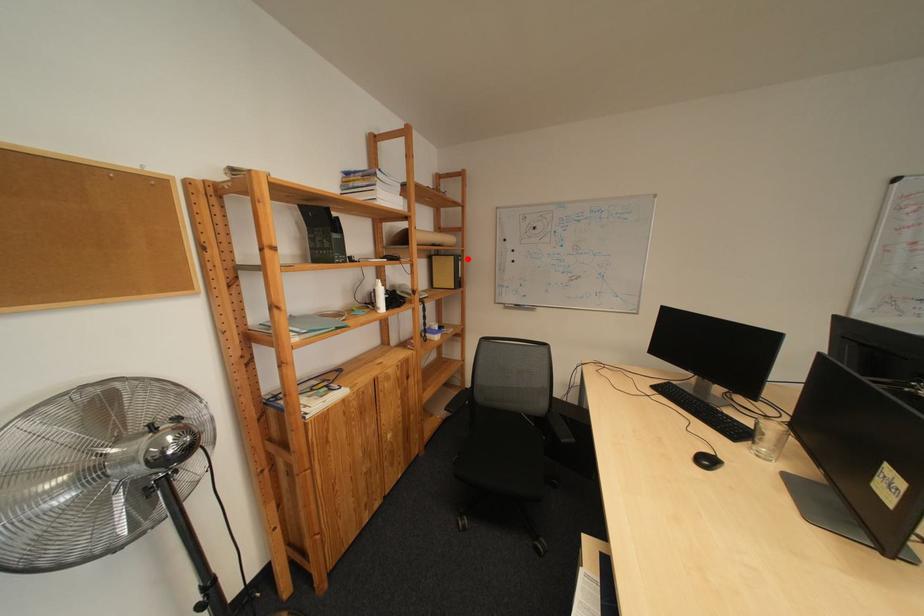
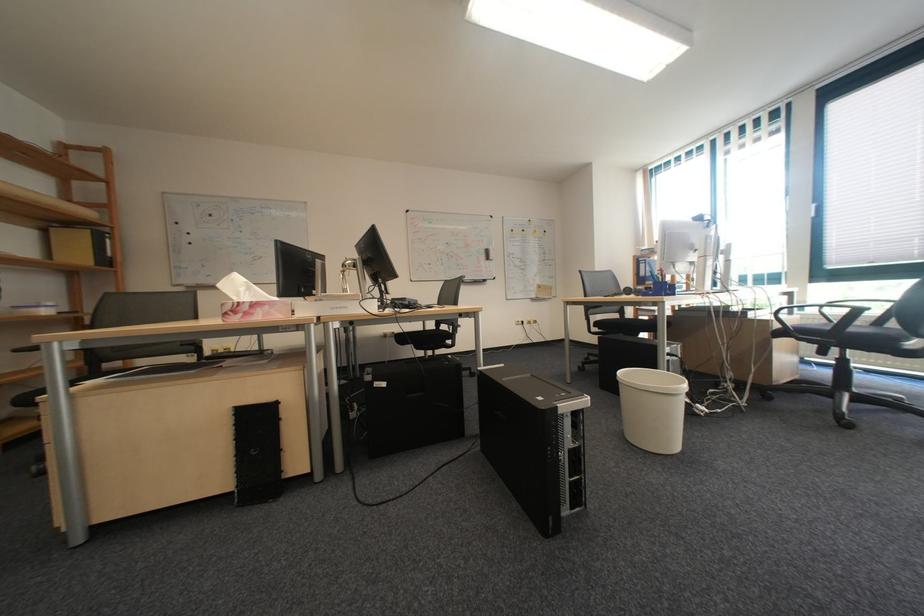
Question: I am providing you with two images of the same scene from different viewpoints. A red point is marked on the first image. At the location where the point appears in image 1, is it still visible in image 2?

Choices:
 (A) Yes
 (B) No

Answer: (A)